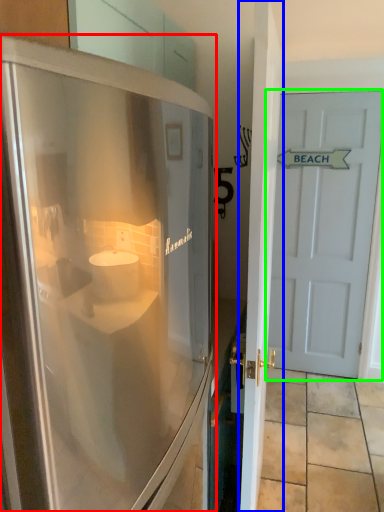
Question: Which object is positioned closest to refrigerator (highlighted by a red box)? Select from door (highlighted by a blue box) and door (highlighted by a green box).

Choices:
 (A) door
 (B) door

Answer: (A)